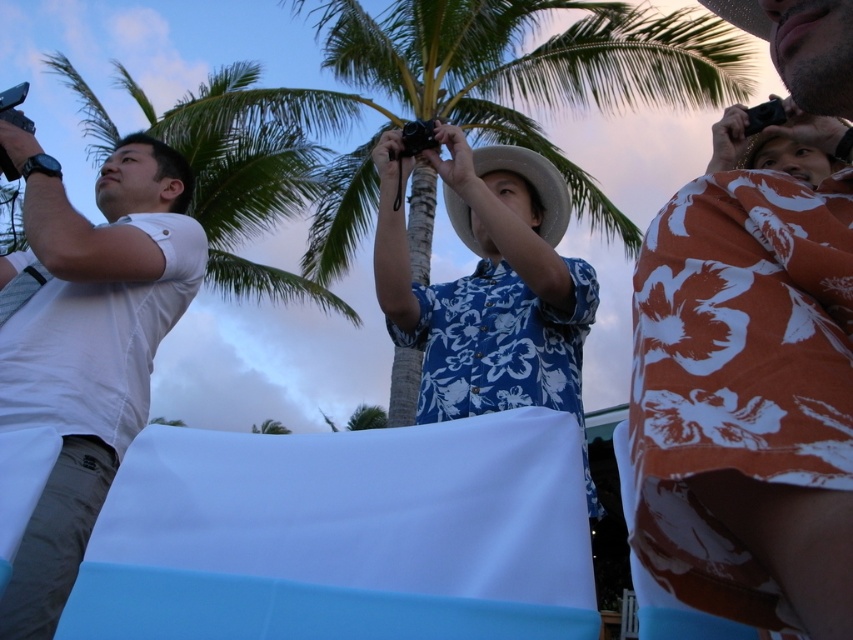
Question: Which of the following is the closest to the observer?

Choices:
 (A) (77, 529)
 (B) (331, 298)
 (C) (775, 504)

Answer: (C)

Question: Which point is farther from the camera taking this photo?

Choices:
 (A) (70, 358)
 (B) (436, 45)
 (C) (181, 138)

Answer: (C)

Question: Does green leafy palm tree at center have a larger size compared to blue floral shirt at center?

Choices:
 (A) no
 (B) yes

Answer: (B)

Question: Can you confirm if floral orange shirt at center is smaller than blue floral shirt at center?

Choices:
 (A) yes
 (B) no

Answer: (A)

Question: Does floral orange shirt at center have a greater width compared to blue floral shirt at center?

Choices:
 (A) yes
 (B) no

Answer: (B)

Question: Which of these objects is positioned closest to the green leafy palm tree at center?

Choices:
 (A) floral orange shirt at center
 (B) blue floral shirt at center
 (C) white matte shirt at left

Answer: (B)